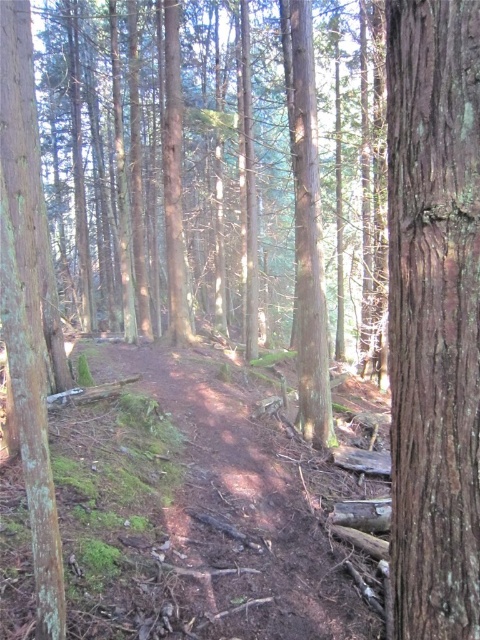
Who is positioned more to the right, smooth brown tree trunk at center-right or smooth brown tree trunk at left?

smooth brown tree trunk at center-right is more to the right.

Looking at this image, who is lower down, smooth brown tree trunk at center-right or smooth brown tree trunk at left?

smooth brown tree trunk at center-right

The height and width of the screenshot is (640, 480). Find the location of `smooth brown tree trunk at center-right`. smooth brown tree trunk at center-right is located at coordinates [x=433, y=314].

Find the location of a particular element. The width and height of the screenshot is (480, 640). smooth brown tree trunk at center-right is located at coordinates (433, 314).

Does brown dirt track at center appear on the right side of smooth brown tree trunk at left?

Yes, brown dirt track at center is to the right of smooth brown tree trunk at left.

Does brown dirt track at center have a smaller size compared to smooth brown tree trunk at left?

Indeed, brown dirt track at center has a smaller size compared to smooth brown tree trunk at left.

Is point (162, 348) more distant than point (3, 99)?

Yes, it is.

You are a GUI agent. You are given a task and a screenshot of the screen. Output one action in this format:
    pyautogui.click(x=<x>, y=<y>)
    Task: Click on the brown dirt track at center
    Image resolution: width=480 pixels, height=640 pixels.
    Given the screenshot: What is the action you would take?
    pos(245,502)

Between smooth brown tree trunk at center-right and brown dirt track at center, which one is positioned lower?

brown dirt track at center is below.

Between smooth brown tree trunk at center-right and brown dirt track at center, which one is positioned higher?

smooth brown tree trunk at center-right

Measure the distance between point (404, 486) and camera.

Point (404, 486) and camera are 1.82 meters apart.

Where is `smooth brown tree trunk at center-right`? Image resolution: width=480 pixels, height=640 pixels. smooth brown tree trunk at center-right is located at coordinates (433, 314).